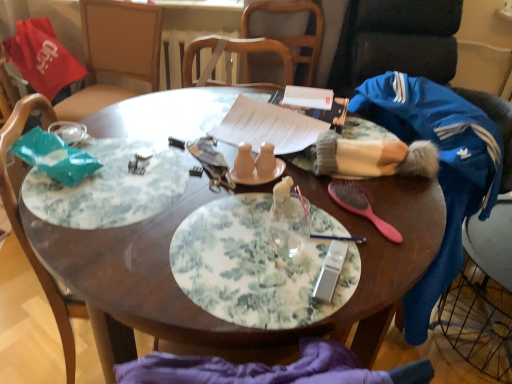
You are a GUI agent. You are given a task and a screenshot of the screen. Output one action in this format:
    pyautogui.click(x=<x>, y=<y>)
    Task: Click on the vacant space behind metallic silver pen at center, which appears as the fourth tableware when viewed from the left
    The image size is (512, 384).
    Given the screenshot: What is the action you would take?
    pyautogui.click(x=336, y=199)